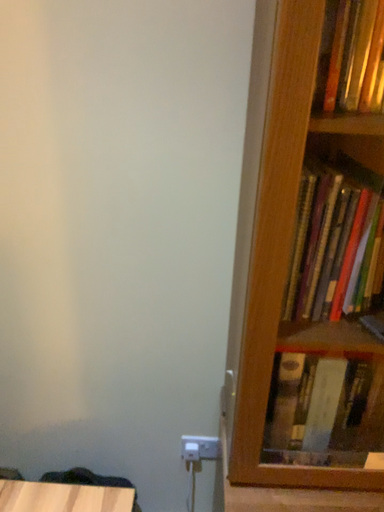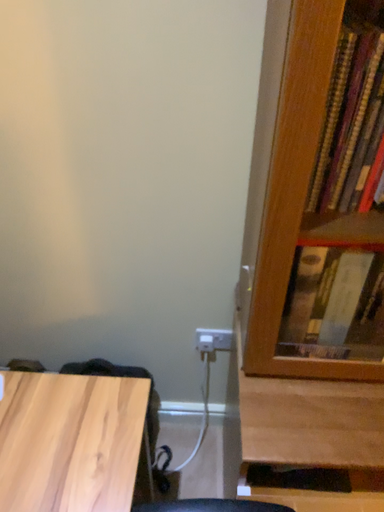
Question: How did the camera likely rotate when shooting the video?

Choices:
 (A) rotated upward
 (B) rotated downward

Answer: (B)